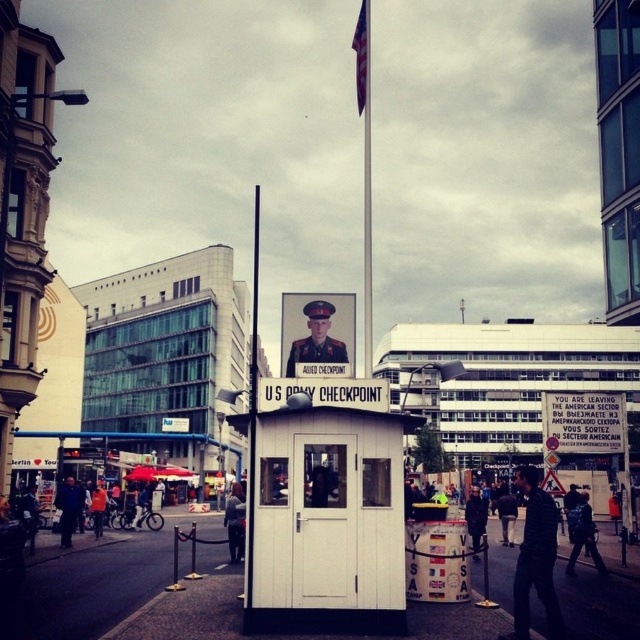
You are a tourist visiting Checkpoint Charlie and want to take a photo with the U.S. Army Checkpoint booth in the background. You see a uniformed officer at center and dark blue jeans at center. Which object is positioned to the left of the other?

The uniformed officer at center is to the left of dark blue jeans at center.

You are a tourist standing at the Checkpoint Charlie booth and want to take a photo of the uniformed officer at center with your camera. The camera requires you to be at least 35 meters away to capture the entire scene in one shot. Can you do it?

The uniformed officer at center and camera are 37.39 meters apart from each other. Since 37.39 meters is greater than the required 35 meters, you can take the photo and capture the entire scene in one shot.